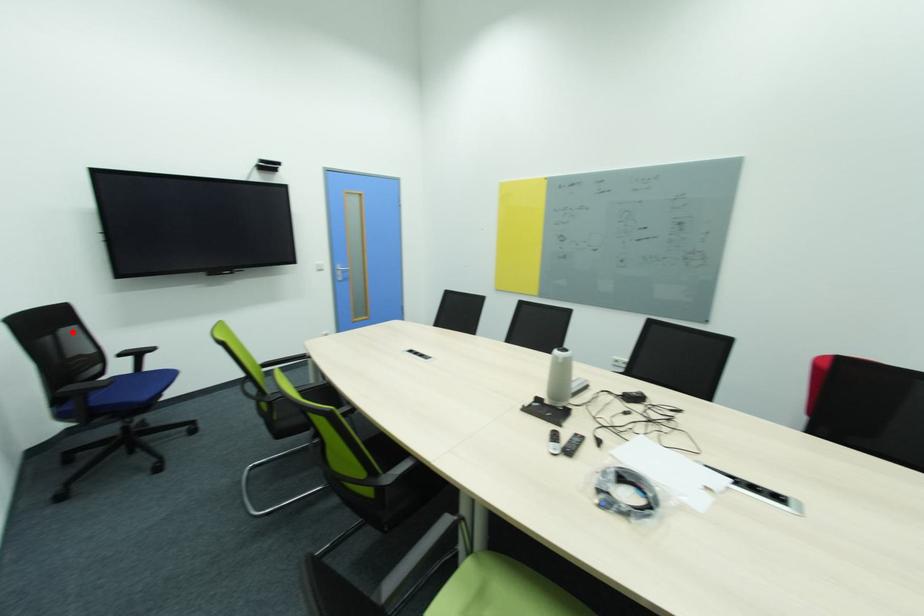
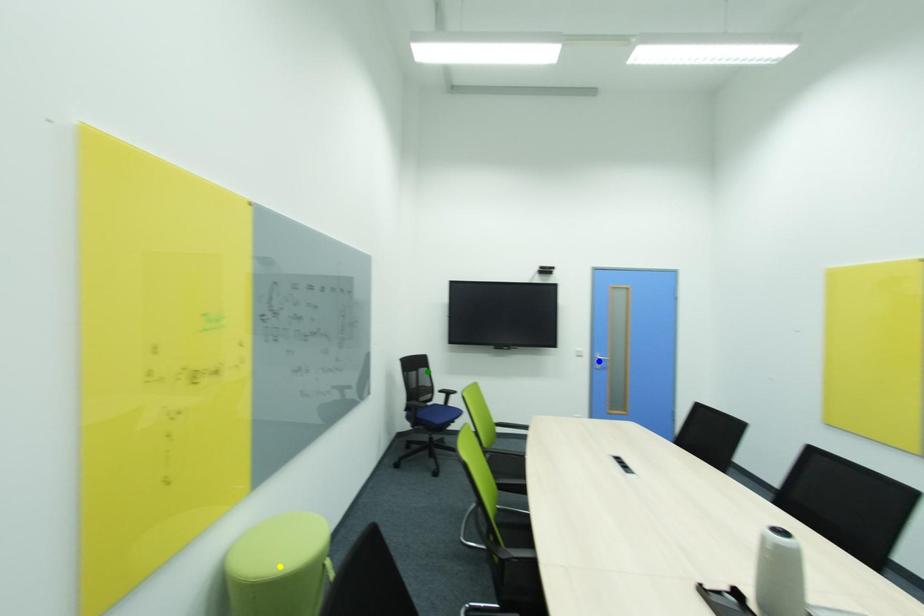
Question: I am providing you with two images of the same scene from different viewpoints. A red point is marked on the first image. You are given multiple points on the second image. Which spot in image 2 lines up with the point in image 1?

Choices:
 (A) blue point
 (B) yellow point
 (C) green point

Answer: (C)